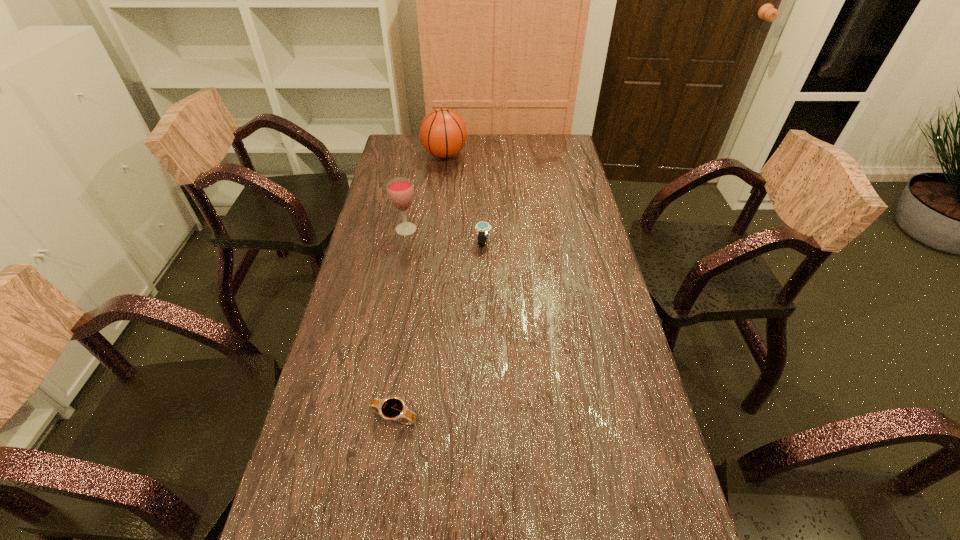
You are a GUI agent. You are given a task and a screenshot of the screen. Output one action in this format:
    pyautogui.click(x=<x>, y=<y>)
    Task: Click on the object located at the far edge
    
    Given the screenshot: What is the action you would take?
    pyautogui.click(x=443, y=133)

You are a GUI agent. You are given a task and a screenshot of the screen. Output one action in this format:
    pyautogui.click(x=<x>, y=<y>)
    Task: Click on the basketball that is at the left edge
    The height and width of the screenshot is (540, 960).
    Given the screenshot: What is the action you would take?
    click(443, 133)

Locate an element on the screen. This screenshot has width=960, height=540. wineglass that is at the left edge is located at coordinates (400, 190).

At what (x,y) coordinates should I click in order to perform the action: click on watch positioned at the left edge. Please return your answer as a coordinate pair (x, y). This screenshot has width=960, height=540. Looking at the image, I should click on (391, 408).

The height and width of the screenshot is (540, 960). I want to click on object present at the far left corner, so click(x=443, y=133).

The image size is (960, 540). Identify the location of vacant area at the far edge. (489, 136).

Identify the location of free space at the left edge of the desktop. This screenshot has width=960, height=540. (348, 302).

Find the location of `vacant space at the right edge`. vacant space at the right edge is located at coordinates (559, 217).

Image resolution: width=960 pixels, height=540 pixels. What are the coordinates of `free spot at the far left corner of the desktop` in the screenshot? It's located at (404, 137).

In the image, there is a desktop. In order to click on free space at the far right corner in this screenshot , I will do `click(570, 139)`.